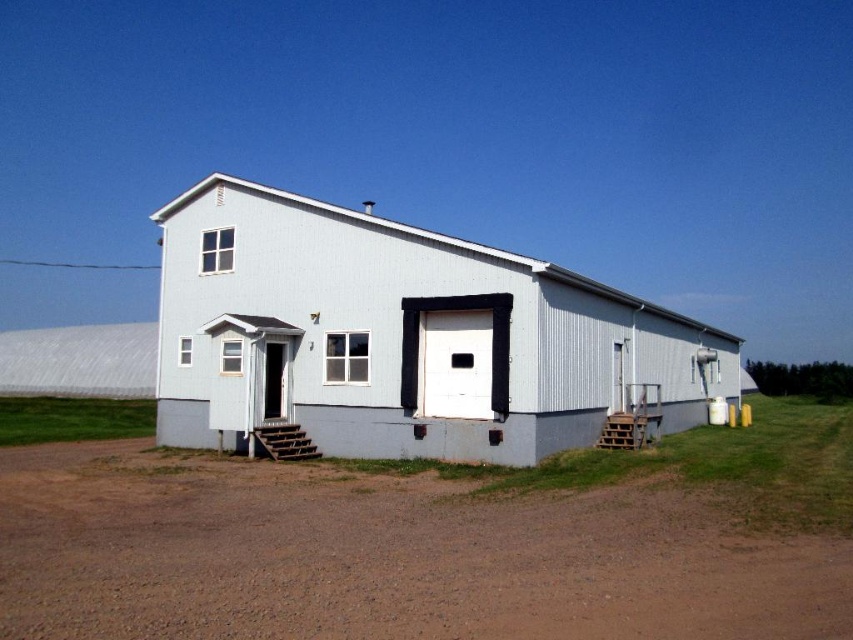
Does light blue siding at center have a lesser width compared to white matte garage door at center?

No, light blue siding at center is not thinner than white matte garage door at center.

Does light blue siding at center appear on the left side of white matte garage door at center?

Incorrect, light blue siding at center is not on the left side of white matte garage door at center.

Which is behind, point (461, 268) or point (454, 355)?

The point (454, 355) is behind.

Locate an element on the screen. light blue siding at center is located at coordinates (399, 336).

In the scene shown: Which is below, brown dirt field at lower center or light blue siding at center?

brown dirt field at lower center is lower down.

Between brown dirt field at lower center and light blue siding at center, which one appears on the right side from the viewer's perspective?

light blue siding at center

At what (x,y) coordinates should I click in order to perform the action: click on brown dirt field at lower center. Please return your answer as a coordinate pair (x, y). Image resolution: width=853 pixels, height=640 pixels. Looking at the image, I should click on (437, 541).

Which is behind, point (83, 445) or point (419, 353)?

The point (83, 445) is more distant.

Locate an element on the screen. Image resolution: width=853 pixels, height=640 pixels. brown dirt field at lower center is located at coordinates (437, 541).